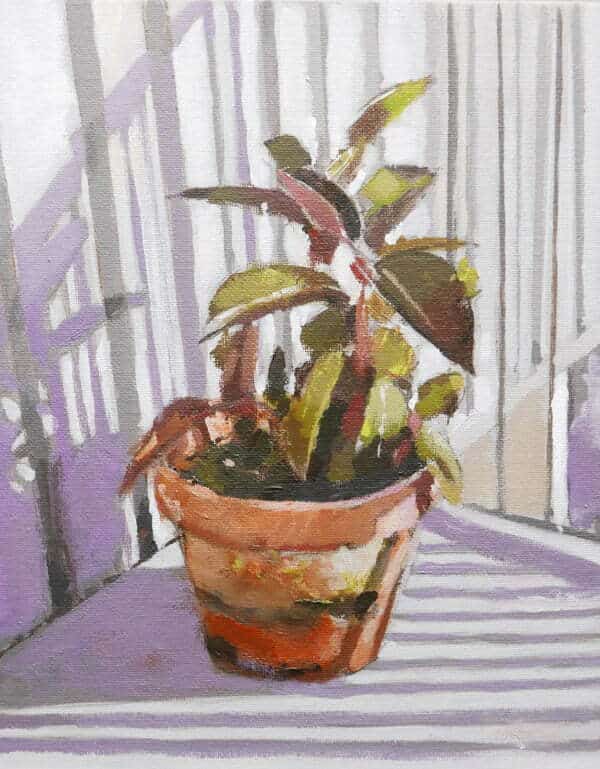
This screenshot has width=600, height=769. I want to click on center right side of pot of painted plant, so click(394, 583).